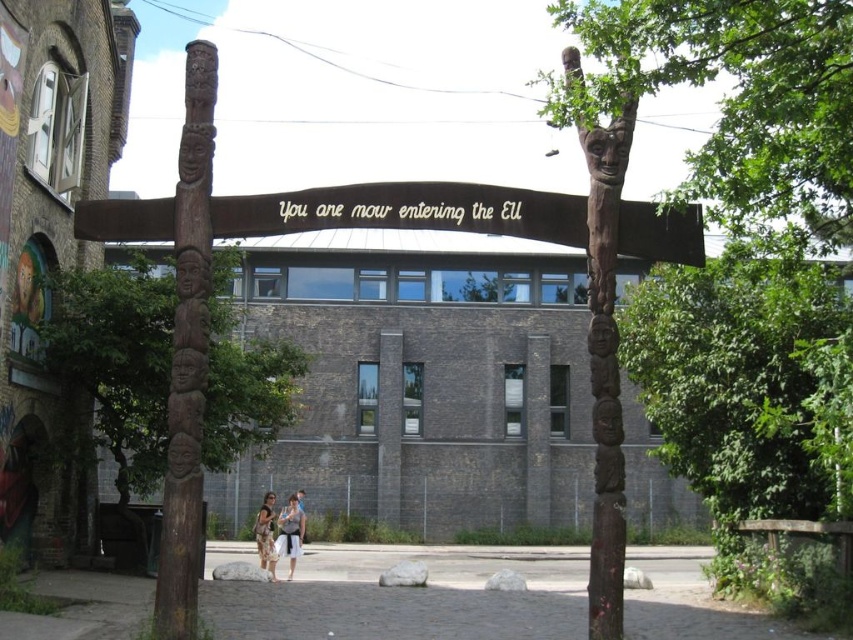
Question: Observing the image, what is the correct spatial positioning of matte beige dress at center in reference to floral dress at center?

Choices:
 (A) below
 (B) above

Answer: (B)

Question: Which object is closer to the camera taking this photo?

Choices:
 (A) matte beige dress at center
 (B) wooden totem pole at center

Answer: (B)

Question: Which of the following is the farthest from the observer?

Choices:
 (A) brown carved totem pole at left
 (B) floral dress at center
 (C) matte beige dress at center

Answer: (C)

Question: In this image, where is brown carved totem pole at left located relative to wooden totem pole at center?

Choices:
 (A) above
 (B) below

Answer: (A)

Question: Observing the image, what is the correct spatial positioning of brown carved totem pole at left in reference to floral dress at center?

Choices:
 (A) above
 (B) below

Answer: (A)

Question: Which object is positioned farthest from the floral dress at center?

Choices:
 (A) wooden totem pole at center
 (B) brown carved totem pole at left
 (C) brown wooden sign at center

Answer: (C)